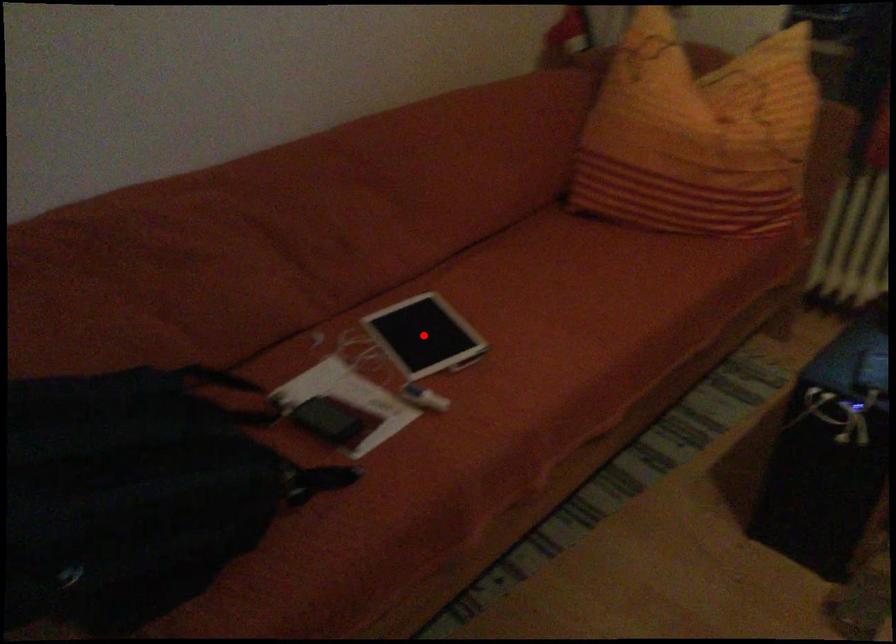
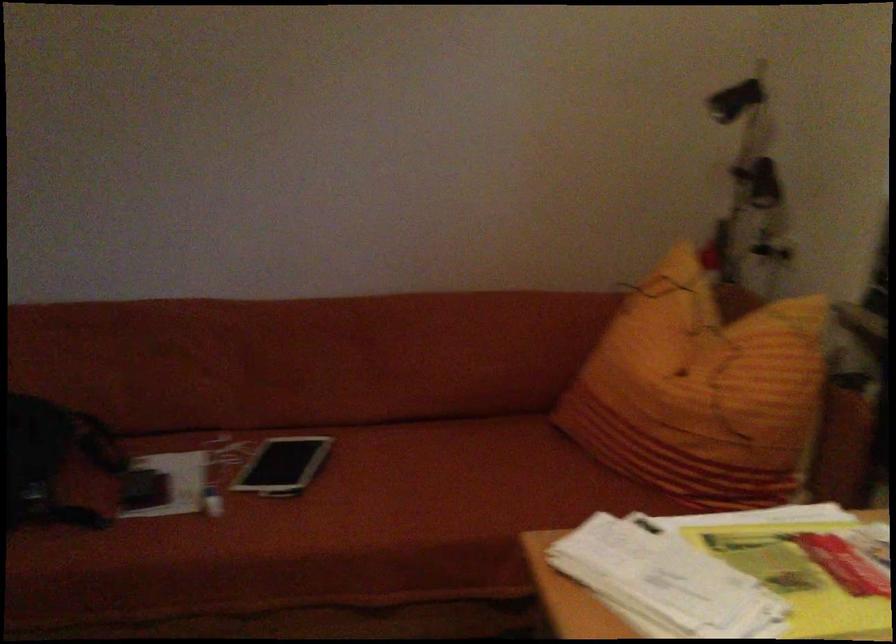
Question: I am providing you with two images of the same scene from different viewpoints. A red point is marked on the first image. Can you still see the location of the red point in image 2?

Choices:
 (A) Yes
 (B) No

Answer: (B)